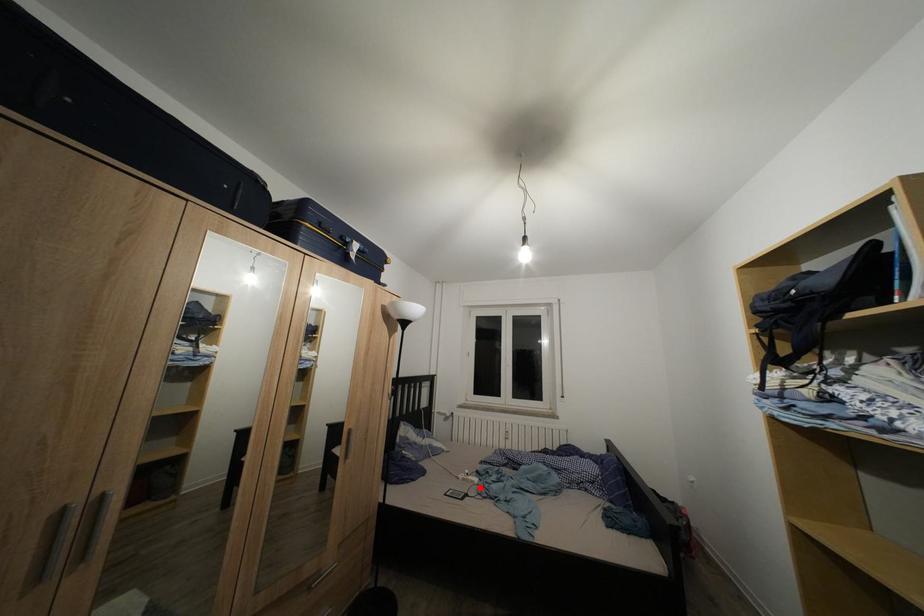
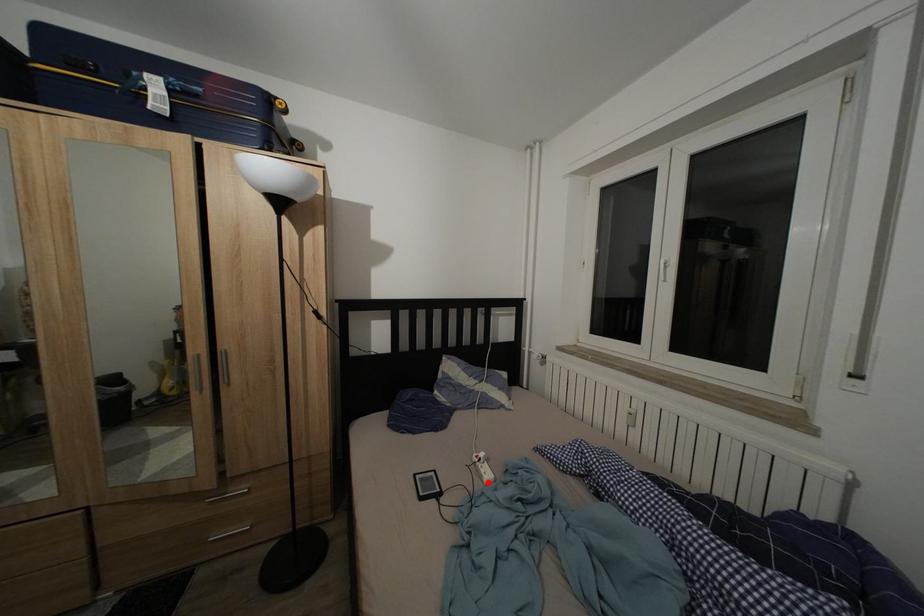
I am providing you with two images of the same scene from different viewpoints. A red point is marked on the first image and another point is marked on the second image. Is the marked point in image1 the same physical position as the marked point in image2?

Yes